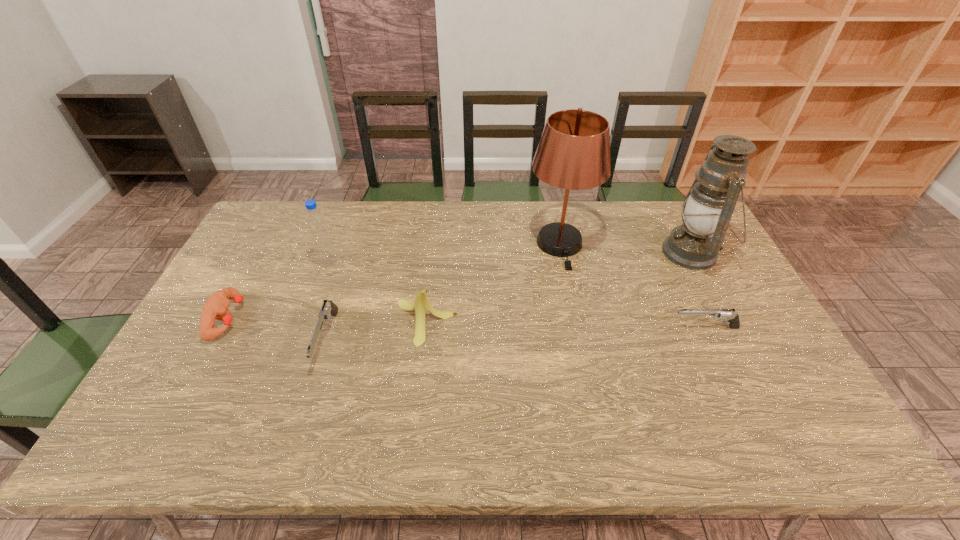
Locate an element on the screen. The width and height of the screenshot is (960, 540). oil lamp that is at the far edge is located at coordinates (708, 207).

Identify the location of object located at the left edge. This screenshot has width=960, height=540. (216, 307).

Find the location of a particular element. This screenshot has height=540, width=960. pistol present at the right edge is located at coordinates (732, 318).

Locate an element on the screen. This screenshot has width=960, height=540. oil lamp that is at the right edge is located at coordinates (708, 207).

Identify the location of object present at the far right corner. The width and height of the screenshot is (960, 540). (708, 207).

You are a GUI agent. You are given a task and a screenshot of the screen. Output one action in this format:
    pyautogui.click(x=<x>, y=<y>)
    Task: Click on the vacant space at the far edge of the desktop
    The image size is (960, 540).
    Given the screenshot: What is the action you would take?
    click(x=619, y=209)

I want to click on vacant position at the near edge of the desktop, so click(468, 406).

In the image, there is a desktop. In order to click on blank space at the left edge in this screenshot , I will do `click(274, 278)`.

I want to click on vacant area at the near left corner of the desktop, so click(x=156, y=407).

In the image, there is a desktop. Where is `vacant space at the near right corner`? Image resolution: width=960 pixels, height=540 pixels. vacant space at the near right corner is located at coordinates (749, 393).